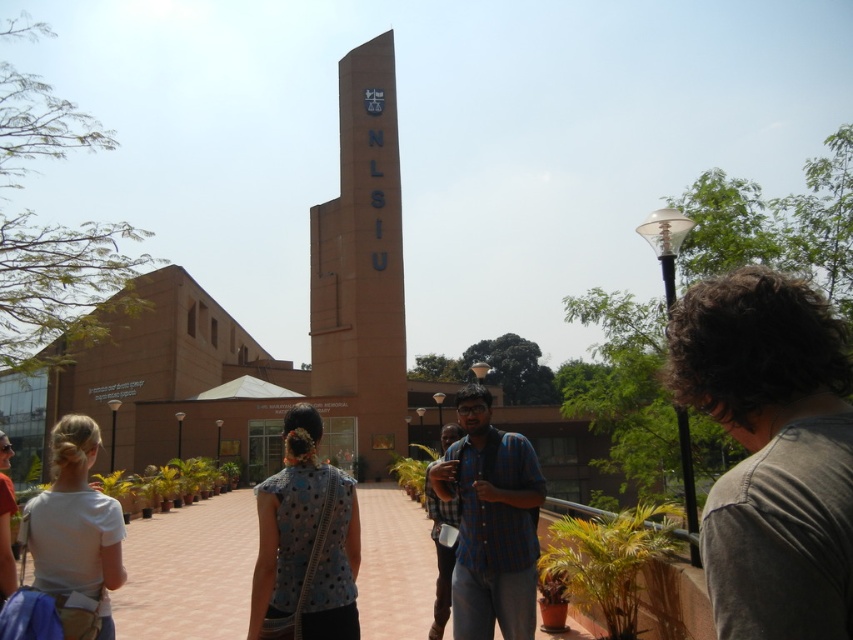
Can you confirm if brown brick pathway at center is thinner than checkered fabric shirt at center?

No.

Can you confirm if brown brick pathway at center is wider than checkered fabric shirt at center?

Yes, brown brick pathway at center is wider than checkered fabric shirt at center.

Is point (213, 525) farther from camera compared to point (474, 524)?

Yes.

I want to click on brown brick pathway at center, so click(189, 572).

Does blue dotted blouse at center have a larger size compared to checkered fabric shirt at center?

Correct, blue dotted blouse at center is larger in size than checkered fabric shirt at center.

Can you confirm if blue dotted blouse at center is shorter than checkered fabric shirt at center?

No, blue dotted blouse at center is not shorter than checkered fabric shirt at center.

Is point (305, 545) more distant than point (451, 461)?

No, it is in front of (451, 461).

The height and width of the screenshot is (640, 853). I want to click on blue dotted blouse at center, so click(305, 541).

Between brown matte tower at center and white matte shirt at lower left, which one has more height?

Standing taller between the two is brown matte tower at center.

Can you confirm if brown matte tower at center is positioned below white matte shirt at lower left?

Incorrect, brown matte tower at center is not positioned below white matte shirt at lower left.

Which is behind, point (357, 138) or point (94, 442)?

Point (357, 138)

You are a GUI agent. You are given a task and a screenshot of the screen. Output one action in this format:
    pyautogui.click(x=<x>, y=<y>)
    Task: Click on the brown matte tower at center
    The height and width of the screenshot is (640, 853).
    Given the screenshot: What is the action you would take?
    pyautogui.click(x=363, y=260)